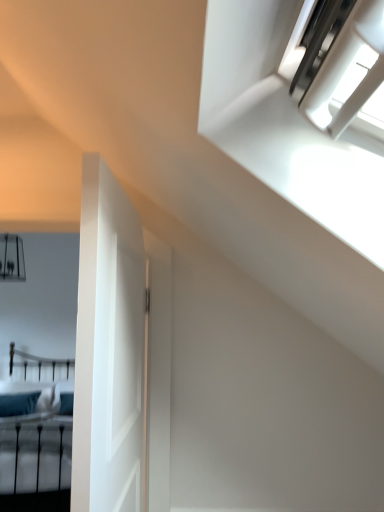
Question: Is white matte door at left in contact with teal fabric pillow at lower left?

Choices:
 (A) no
 (B) yes

Answer: (A)

Question: Is white matte door at left looking in the opposite direction of teal fabric pillow at lower left?

Choices:
 (A) yes
 (B) no

Answer: (B)

Question: Is white matte door at left to the right of teal fabric pillow at lower left from the viewer's perspective?

Choices:
 (A) yes
 (B) no

Answer: (A)

Question: Does white matte door at left have a greater width compared to teal fabric pillow at lower left?

Choices:
 (A) yes
 (B) no

Answer: (B)

Question: Considering the relative sizes of white matte door at left and teal fabric pillow at lower left in the image provided, is white matte door at left bigger than teal fabric pillow at lower left?

Choices:
 (A) yes
 (B) no

Answer: (A)

Question: From a real-world perspective, is white matte door at left below teal fabric pillow at lower left?

Choices:
 (A) yes
 (B) no

Answer: (B)

Question: Is teal fabric bed at lower left positioned in front of teal fabric pillow at lower left?

Choices:
 (A) yes
 (B) no

Answer: (A)

Question: Is teal fabric bed at lower left shorter than teal fabric pillow at lower left?

Choices:
 (A) no
 (B) yes

Answer: (A)

Question: Can teal fabric pillow at lower left be found inside teal fabric bed at lower left?

Choices:
 (A) yes
 (B) no

Answer: (A)

Question: Is teal fabric bed at lower left at the right side of teal fabric pillow at lower left?

Choices:
 (A) no
 (B) yes

Answer: (B)

Question: Is teal fabric bed at lower left to the left of teal fabric pillow at lower left from the viewer's perspective?

Choices:
 (A) yes
 (B) no

Answer: (B)

Question: Does teal fabric bed at lower left turn towards teal fabric pillow at lower left?

Choices:
 (A) yes
 (B) no

Answer: (B)

Question: Is white matte door at left turned away from teal fabric bed at lower left?

Choices:
 (A) no
 (B) yes

Answer: (A)